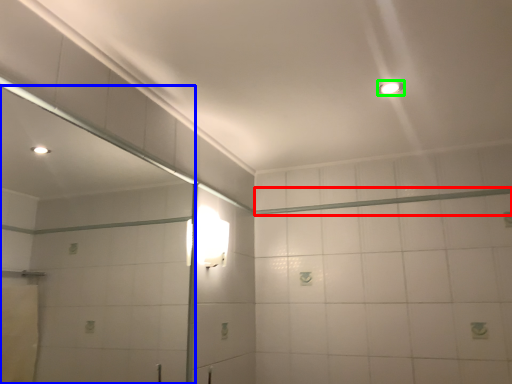
Question: Which is nearer to the beam (highlighted by a red box)? mirror (highlighted by a blue box) or light fixture (highlighted by a green box).

Choices:
 (A) mirror
 (B) light fixture

Answer: (B)